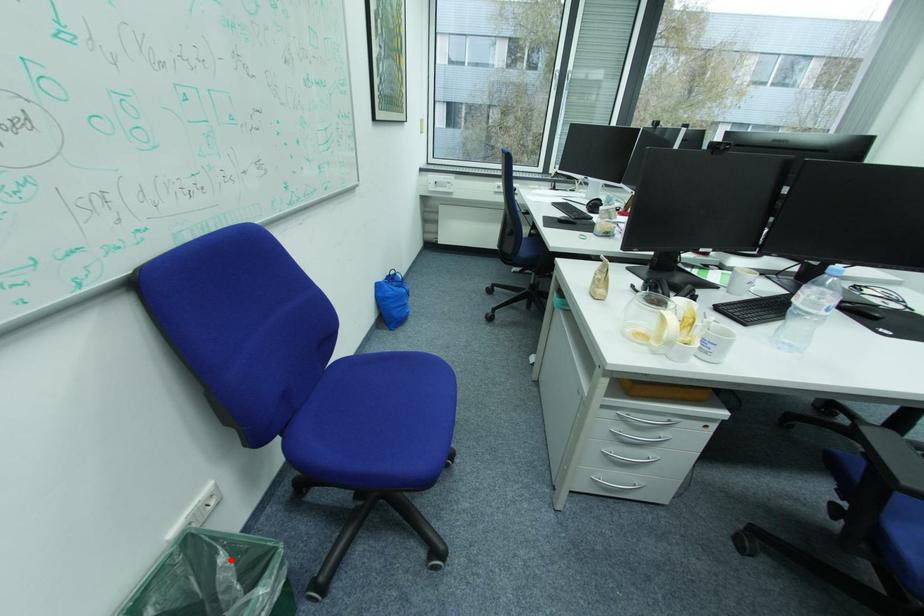
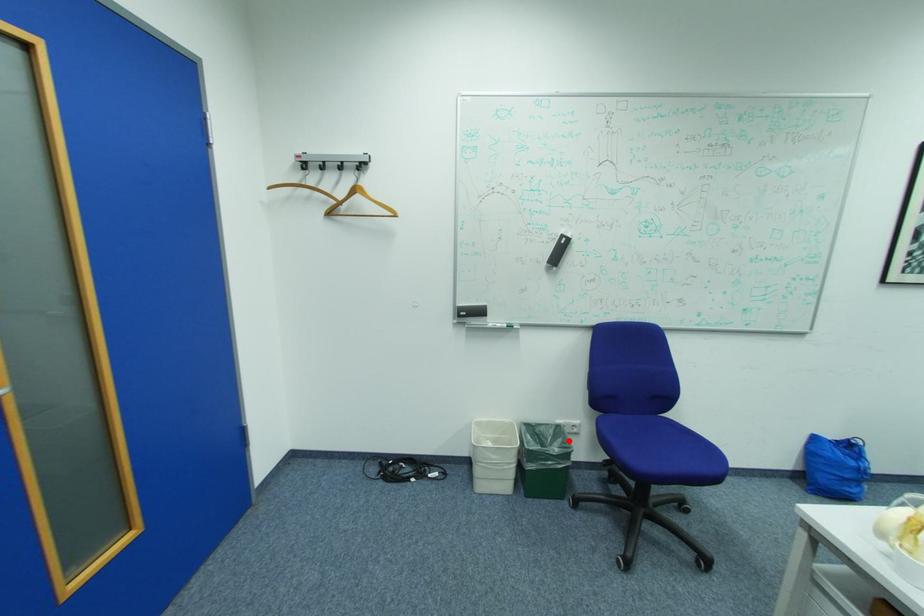
I am providing you with two images of the same scene from different viewpoints. A red point is marked on the first image and another point is marked on the second image. Are the points marked in image1 and image2 representing the same 3D position?

Yes